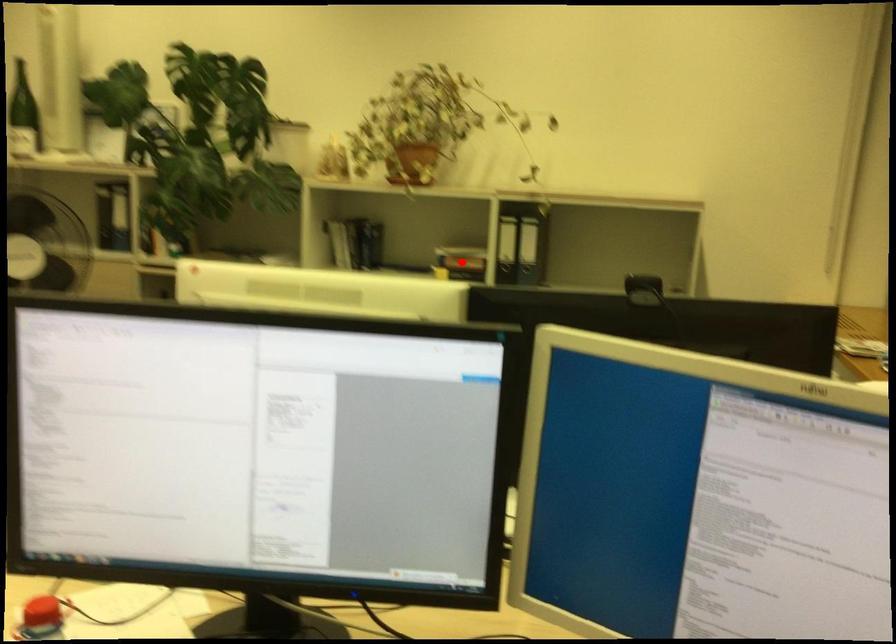
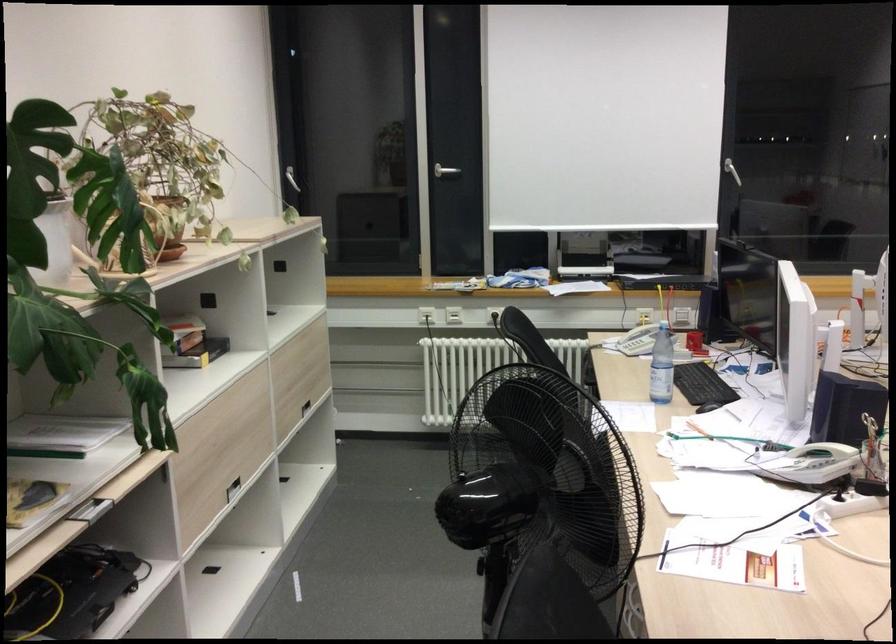
Question: I am providing you with two images of the same scene from different viewpoints. A red point is shown in image1. For the corresponding object point in image2, is it positioned nearer or farther from the camera?

Choices:
 (A) Nearer
 (B) Farther

Answer: (A)